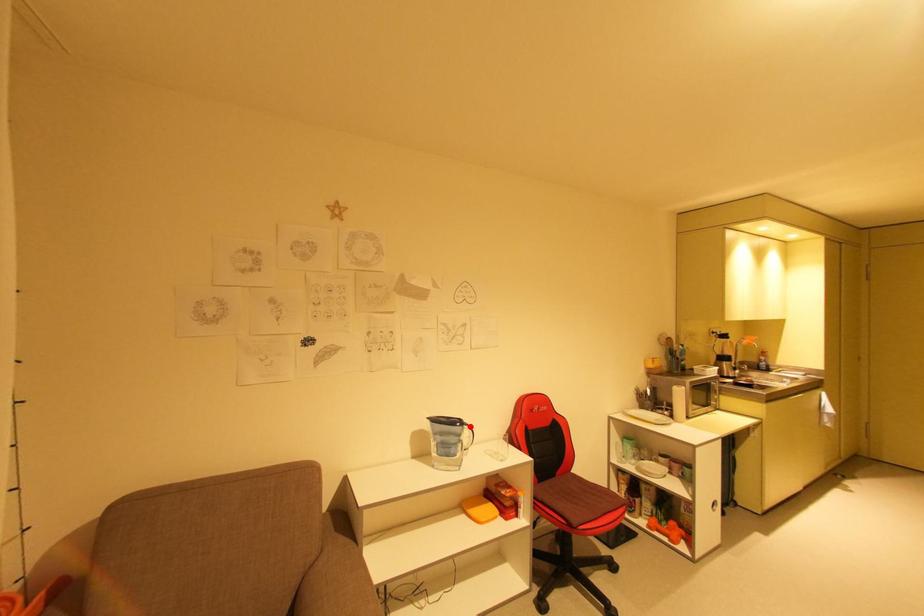
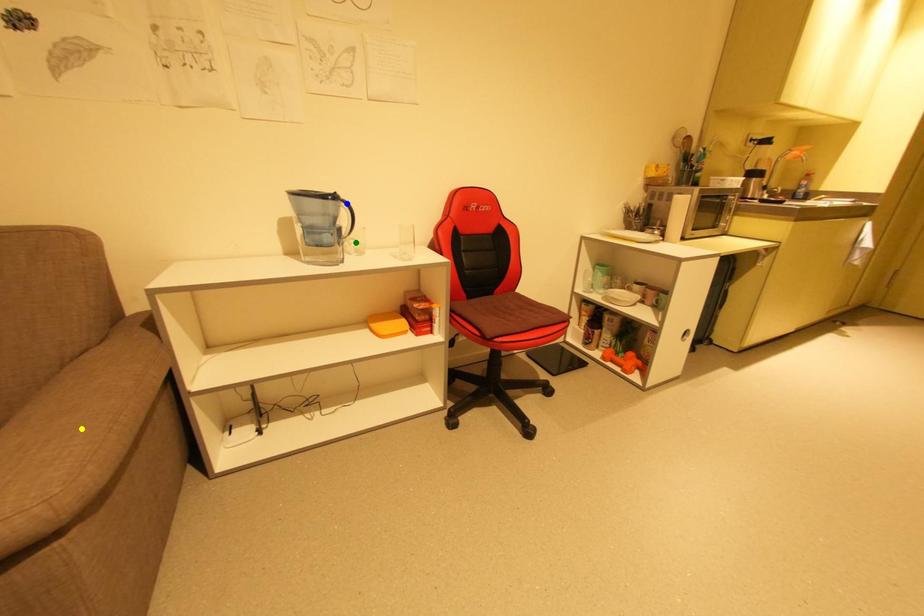
Question: I am providing you with two images of the same scene from different viewpoints. A red point is marked on the first image. You are given multiple points on the second image. Which point in image 2 is actually the same real-world point as the red point in image 1?

Choices:
 (A) blue point
 (B) green point
 (C) yellow point

Answer: (A)